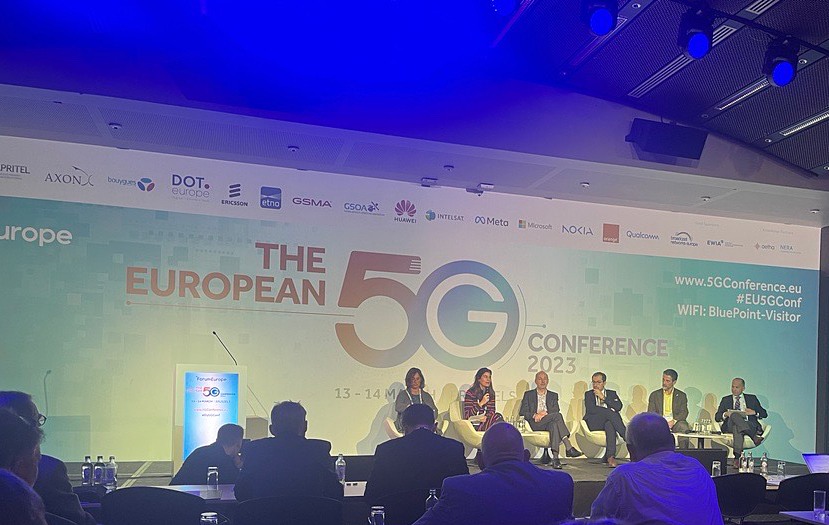
This screenshot has width=829, height=525. Find the location of `white chair`. white chair is located at coordinates (440, 426), (463, 427), (531, 435), (590, 436), (729, 439).